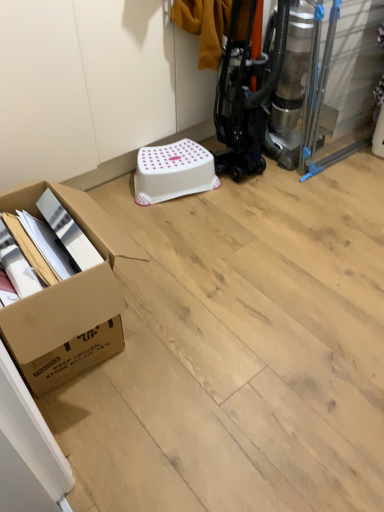
Question: From the image's perspective, is white plastic stool at center on brown cardboard box at lower left?

Choices:
 (A) no
 (B) yes

Answer: (B)

Question: Is white plastic stool at center shorter than brown cardboard box at lower left?

Choices:
 (A) yes
 (B) no

Answer: (A)

Question: Can you confirm if white plastic stool at center is smaller than brown cardboard box at lower left?

Choices:
 (A) yes
 (B) no

Answer: (A)

Question: Could you tell me if white plastic stool at center is facing brown cardboard box at lower left?

Choices:
 (A) no
 (B) yes

Answer: (A)

Question: Are white plastic stool at center and brown cardboard box at lower left beside each other?

Choices:
 (A) no
 (B) yes

Answer: (A)

Question: From the image's perspective, is white plastic stool at center beneath brown cardboard box at lower left?

Choices:
 (A) no
 (B) yes

Answer: (A)

Question: Is brown cardboard box at lower left outside white plastic stool at center?

Choices:
 (A) no
 (B) yes

Answer: (B)

Question: Can you confirm if brown cardboard box at lower left is thinner than white plastic stool at center?

Choices:
 (A) no
 (B) yes

Answer: (A)

Question: Is brown cardboard box at lower left further to camera compared to white plastic stool at center?

Choices:
 (A) yes
 (B) no

Answer: (B)

Question: Does brown cardboard box at lower left lie in front of white plastic stool at center?

Choices:
 (A) yes
 (B) no

Answer: (A)

Question: Considering the relative sizes of brown cardboard box at lower left and white plastic stool at center in the image provided, is brown cardboard box at lower left shorter than white plastic stool at center?

Choices:
 (A) yes
 (B) no

Answer: (B)

Question: From a real-world perspective, is brown cardboard box at lower left beneath white plastic stool at center?

Choices:
 (A) no
 (B) yes

Answer: (A)

Question: Considering their positions, is white plastic stool at center located in front of or behind brown cardboard box at lower left?

Choices:
 (A) front
 (B) behind

Answer: (B)